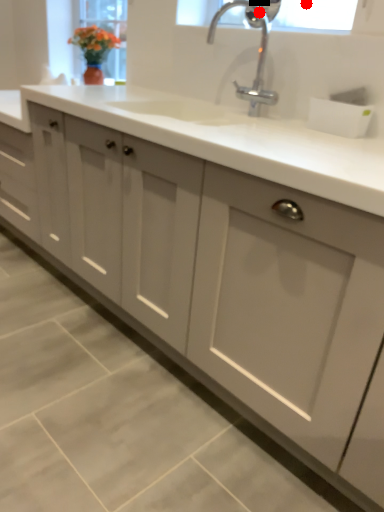
Question: Two points are circled on the image, labeled by A and B beside each circle. Among these points, which one is farthest from the camera?

Choices:
 (A) A is further
 (B) B is further

Answer: (A)